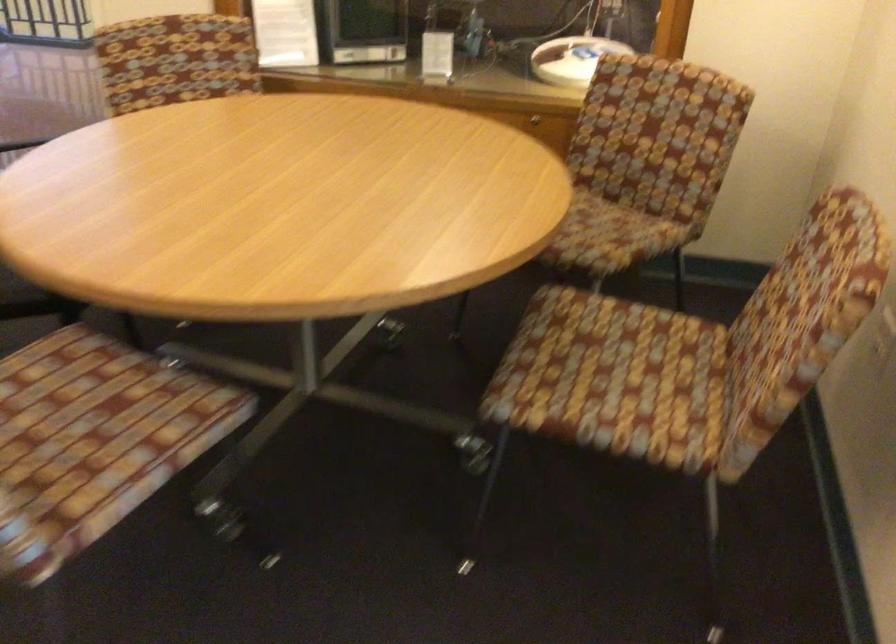
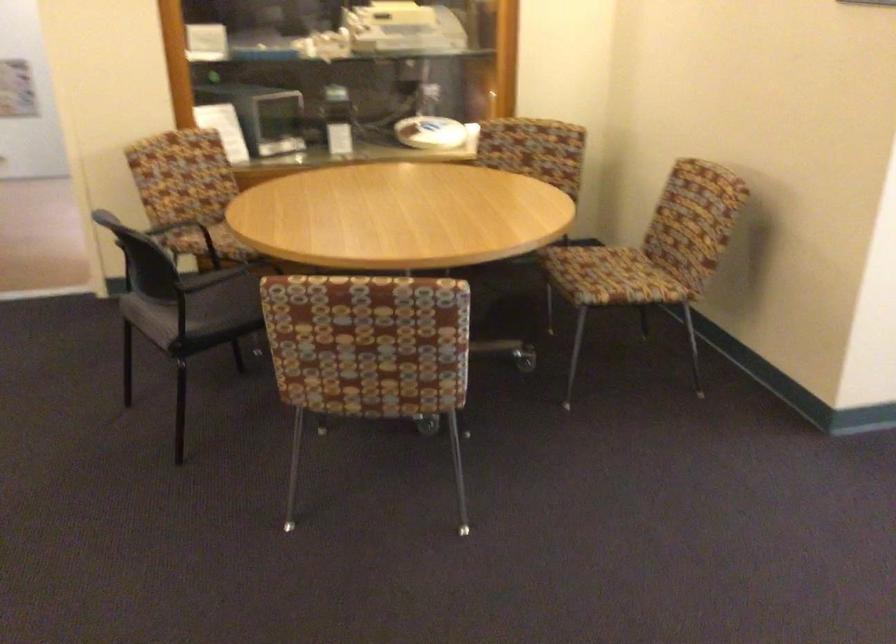
In a continuous first-person perspective shot, in which direction is the camera moving?

The cameraman walked toward left, backward.